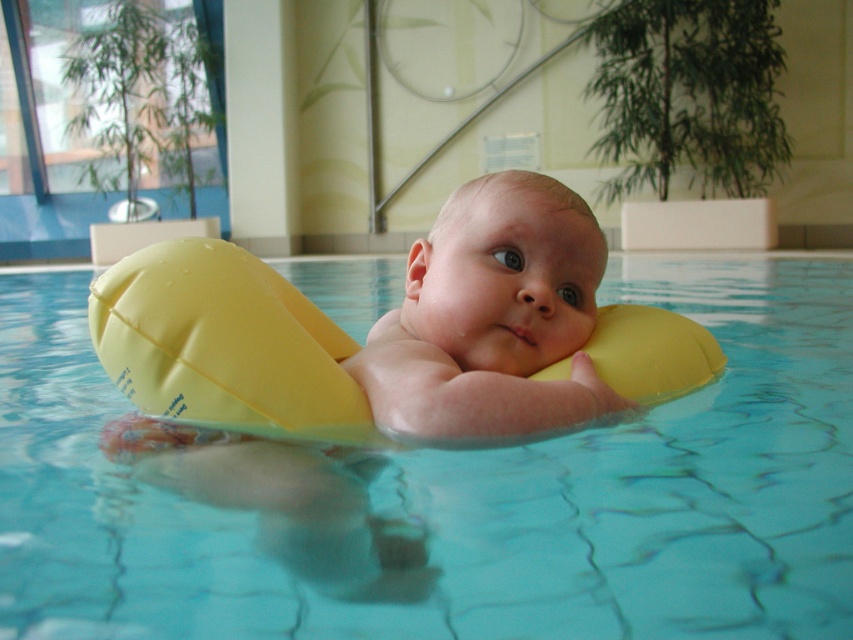
Is transparent yellow float at center above yellow rubber ring at center?

Yes.

Who is taller, transparent yellow float at center or yellow rubber ring at center?

transparent yellow float at center

Locate an element on the screen. Image resolution: width=853 pixels, height=640 pixels. transparent yellow float at center is located at coordinates (463, 496).

Image resolution: width=853 pixels, height=640 pixels. Find the location of `transparent yellow float at center`. transparent yellow float at center is located at coordinates (463, 496).